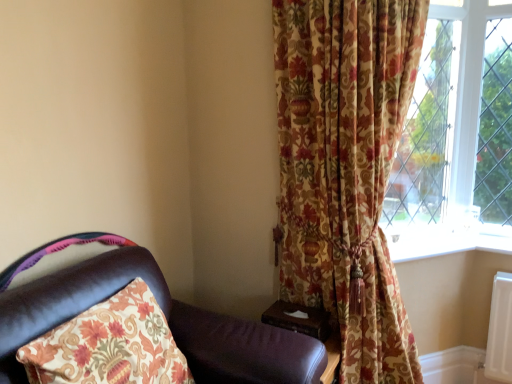
Question: Would you say wooden at right is to the left or to the right of leather chair at left in the picture?

Choices:
 (A) right
 (B) left

Answer: (A)

Question: Is wooden at right taller or shorter than leather chair at left?

Choices:
 (A) tall
 (B) short

Answer: (B)

Question: Estimate the real-world distances between objects in this image. Which object is closer to the leather chair at left?

Choices:
 (A) wooden at right
 (B) white plastic window sill at lower right
 (C) floral fabric curtain at right

Answer: (A)

Question: Estimate the real-world distances between objects in this image. Which object is closer to the white plastic window sill at lower right?

Choices:
 (A) wooden at right
 (B) leather chair at left
 (C) floral fabric curtain at right

Answer: (C)